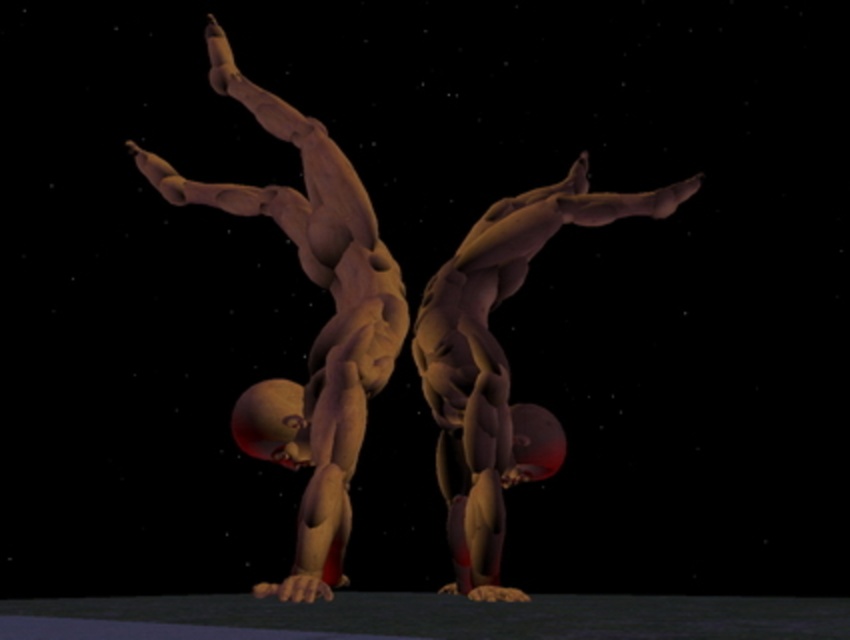
Question: Among these objects, which one is nearest to the camera?

Choices:
 (A) matte brown gymnast at left
 (B) matte brown gymnast at center

Answer: (A)

Question: Can you confirm if matte brown gymnast at left is positioned below matte brown gymnast at center?

Choices:
 (A) no
 (B) yes

Answer: (A)

Question: Which point is farther from the camera taking this photo?

Choices:
 (A) (212, 67)
 (B) (472, 294)

Answer: (A)

Question: In this image, where is matte brown gymnast at left located relative to matte brown gymnast at center?

Choices:
 (A) right
 (B) left

Answer: (B)

Question: Can you confirm if matte brown gymnast at left is thinner than matte brown gymnast at center?

Choices:
 (A) yes
 (B) no

Answer: (B)